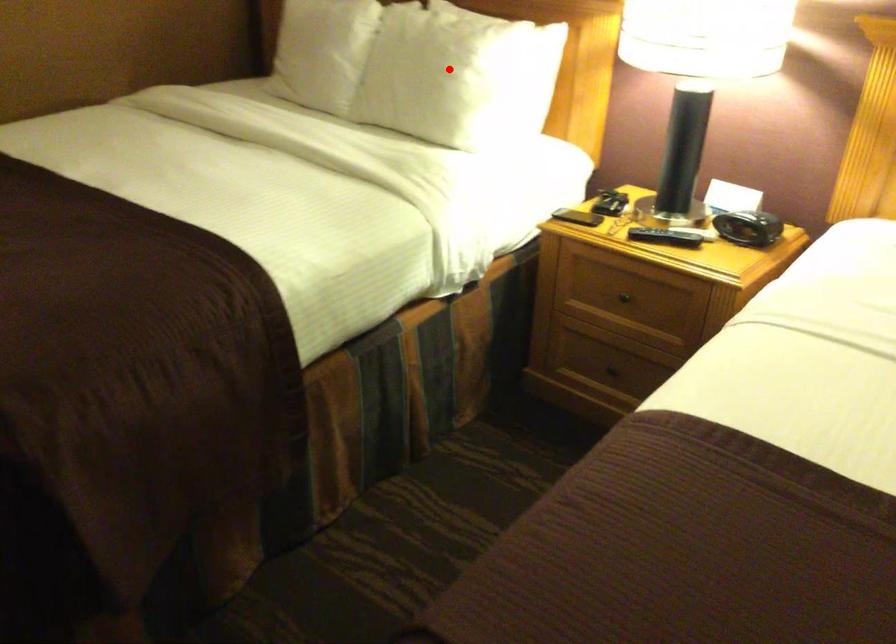
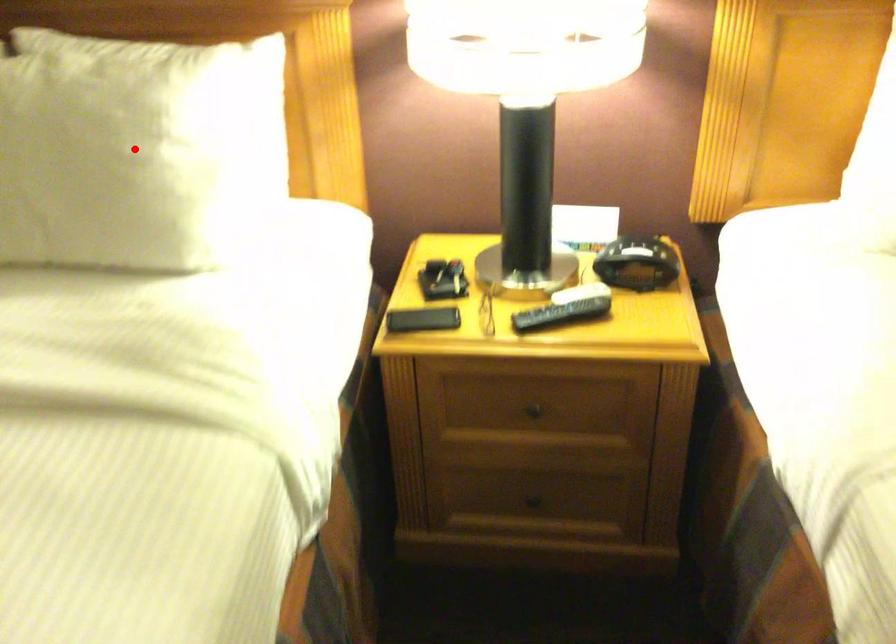
I am providing you with two images of the same scene from different viewpoints. A red point is marked on the first image and another point is marked on the second image. Is the red point in image1 aligned with the point shown in image2?

→ Yes